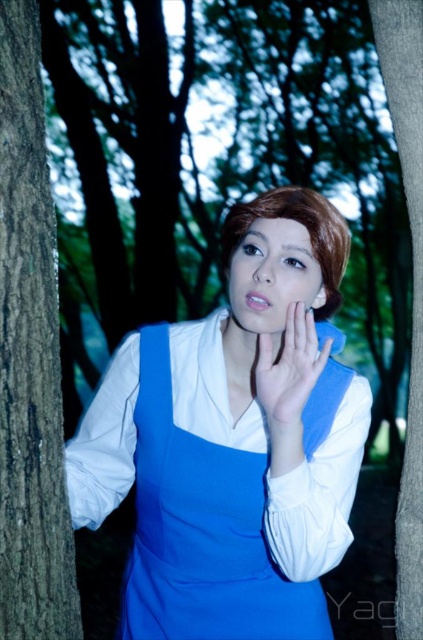
You are a photographer trying to capture a portrait of the person in the center. The smooth brown bark at left and smooth brown hair at center are both in the frame. Which object is wider in the image?

The smooth brown hair at center is wider than the smooth brown bark at left.

You are a hiker trying to identify landmarks in the forest. You notice a point marked at coordinates (30, 356). What does this point correspond to?

The point at (30, 356) corresponds to the smooth brown bark at left.